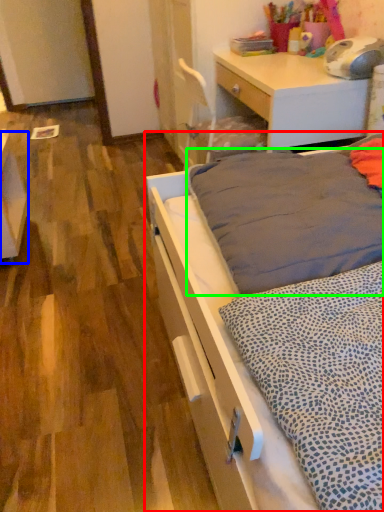
Question: Which object is positioned farthest from bed (highlighted by a red box)? Select from vanity (highlighted by a blue box) and mattress (highlighted by a green box).

Choices:
 (A) vanity
 (B) mattress

Answer: (A)